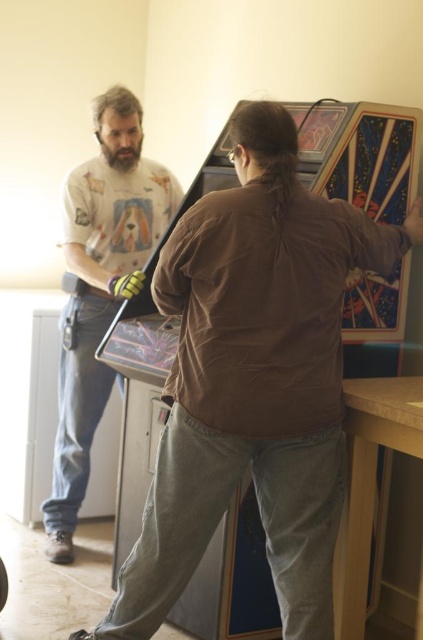
Does brown matte shirt at center appear under white t-shirt with dog print at left?

Yes, brown matte shirt at center is below white t-shirt with dog print at left.

Between brown matte shirt at center and white t-shirt with dog print at left, which one is positioned higher?

white t-shirt with dog print at left

Who is more forward, (184, 257) or (164, 212)?

Positioned in front is point (184, 257).

Identify the location of brown matte shirt at center. (253, 376).